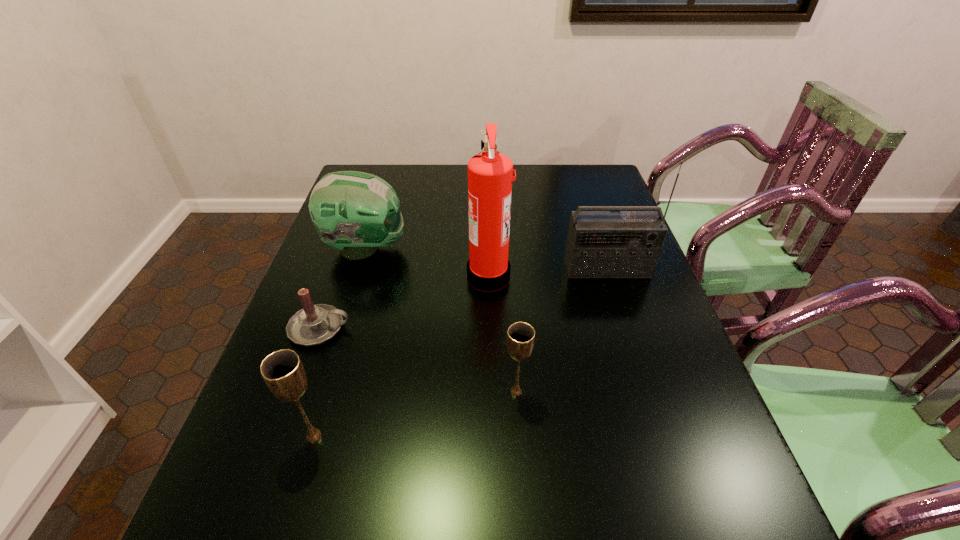
Identify the location of the left chalice. (283, 372).

The image size is (960, 540). In order to click on the taller chalice in this screenshot , I will do `click(283, 372)`.

Where is `the fifth farthest object`? the fifth farthest object is located at coordinates (520, 337).

What are the coordinates of `the shorter chalice` in the screenshot? It's located at (520, 337).

Where is `the second tallest object`? Image resolution: width=960 pixels, height=540 pixels. the second tallest object is located at coordinates (601, 244).

This screenshot has height=540, width=960. In order to click on radio receiver in this screenshot , I will do `click(601, 244)`.

Where is `the tallest object`? The height and width of the screenshot is (540, 960). the tallest object is located at coordinates (490, 174).

This screenshot has height=540, width=960. I want to click on the third nearest object, so click(314, 324).

You are a GUI agent. You are given a task and a screenshot of the screen. Output one action in this format:
    pyautogui.click(x=<x>, y=<y>)
    Task: Click on the candle
    
    Given the screenshot: What is the action you would take?
    pyautogui.click(x=314, y=324)

At what (x,y) coordinates should I click in order to perform the action: click on football helmet. Please return your answer as a coordinate pair (x, y). Looking at the image, I should click on (355, 212).